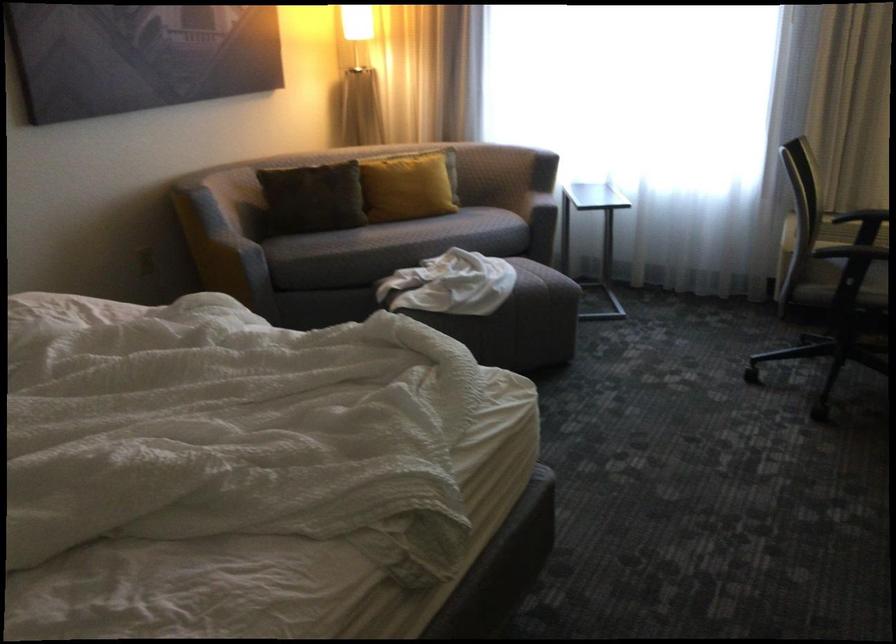
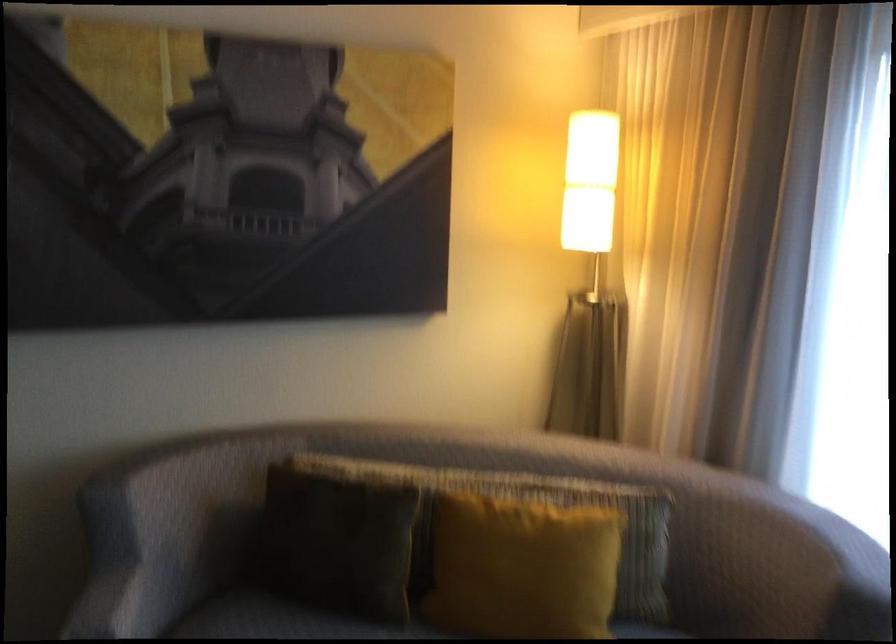
Find the pixel in the second image that matches (322,190) in the first image.

(339, 542)